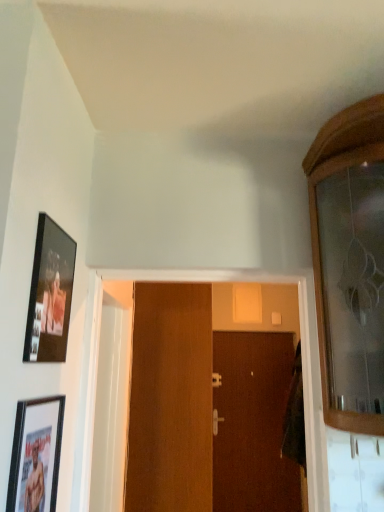
Identify the location of wooden door at center, arranged as the second door when viewed from the right. This screenshot has height=512, width=384. (170, 399).

This screenshot has height=512, width=384. Describe the element at coordinates (253, 423) in the screenshot. I see `brown wooden door at center, positioned as the 1th door in back-to-front order` at that location.

How much space does silver metallic door handle at center, the second door handle positioned from the front, occupy vertically?

It is 7.50 inches.

Where is `wooden door at center, the second door positioned from the back`? wooden door at center, the second door positioned from the back is located at coordinates (170, 399).

Which door handle is the 1st one when counting from the back of the wooden door at center, the first door when ordered from left to right? Please provide its 2D coordinates.

[(216, 421)]

Is wooden door at center, the second door positioned from the back, smaller than silver metallic door handle at center, which is counted as the 1th door handle, starting from the bottom?

No.

Is wooden door at center, arranged as the second door when viewed from the right, facing towards silver metallic door handle at center, which is counted as the 1th door handle, starting from the bottom?

No, wooden door at center, arranged as the second door when viewed from the right, is not turned towards silver metallic door handle at center, which is counted as the 1th door handle, starting from the bottom.

Between wooden door at center, the second door positioned from the back, and silver metallic door handle at center, marked as the 2th door handle in a back-to-front arrangement, which one appears on the left side from the viewer's perspective?

wooden door at center, the second door positioned from the back, is more to the left.

Is brown wooden door at center, which is the 2th door from front to back, far from silver metallic door handle at center, the first door handle from the back?

No, brown wooden door at center, which is the 2th door from front to back, is in close proximity to silver metallic door handle at center, the first door handle from the back.

Is brown wooden door at center, which is the 2th door from front to back, bigger or smaller than silver metallic door handle at center, the first door handle from the back?

brown wooden door at center, which is the 2th door from front to back, is bigger than silver metallic door handle at center, the first door handle from the back.

Is brown wooden door at center, which is the 2th door from front to back, completely or partially outside of silver metallic door handle at center, the second door handle positioned from the front?

brown wooden door at center, which is the 2th door from front to back, is positioned outside silver metallic door handle at center, the second door handle positioned from the front.

From a real-world perspective, is brown wooden door at center, arranged as the 2th door when viewed from the left, below silver metallic door handle at center, the second door handle positioned from the front?

Yes, from a real-world perspective, brown wooden door at center, arranged as the 2th door when viewed from the left, is under silver metallic door handle at center, the second door handle positioned from the front.

Is silver metallic door handle at center, arranged as the 1th door handle when viewed from the front, bigger or smaller than brown wooden door at center, which is the 2th door from front to back?

Considering their sizes, silver metallic door handle at center, arranged as the 1th door handle when viewed from the front, takes up less space than brown wooden door at center, which is the 2th door from front to back.

Which of these two, silver metallic door handle at center, which is the second door handle in top-to-bottom order, or brown wooden door at center, which is the 2th door from front to back, is thinner?

brown wooden door at center, which is the 2th door from front to back.

Consider the image. Considering the sizes of objects silver metallic door handle at center, which is counted as the 1th door handle, starting from the bottom, and brown wooden door at center, arranged as the 2th door when viewed from the left, in the image provided, who is shorter, silver metallic door handle at center, which is counted as the 1th door handle, starting from the bottom, or brown wooden door at center, arranged as the 2th door when viewed from the left,?

silver metallic door handle at center, which is counted as the 1th door handle, starting from the bottom, is shorter.

Which is less distant, (216, 425) or (270, 346)?

Point (216, 425) is closer to the camera than point (270, 346).

Which object is thinner, brown wooden door at center, arranged as the 2th door when viewed from the left, or matte black picture frame at upper left, which is the 1th picture frame in top-to-bottom order?

matte black picture frame at upper left, which is the 1th picture frame in top-to-bottom order, is thinner.

From the image's perspective, does brown wooden door at center, positioned as the 1th door in back-to-front order, appear lower than matte black picture frame at upper left, placed as the 2th picture frame when sorted from bottom to top?

Yes, from the image's perspective, brown wooden door at center, positioned as the 1th door in back-to-front order, is below matte black picture frame at upper left, placed as the 2th picture frame when sorted from bottom to top.

From a real-world perspective, which object rests below the other?

brown wooden door at center, which is counted as the 1th door, starting from the right, from a real-world perspective.

Does brown wooden door at center, which is the 2th door from front to back, appear on the left side of matte black picture frame at upper left, which is the 1th picture frame in top-to-bottom order?

Incorrect, brown wooden door at center, which is the 2th door from front to back, is not on the left side of matte black picture frame at upper left, which is the 1th picture frame in top-to-bottom order.

Does point (222, 418) come in front of point (17, 412)?

That is False.

Is silver metallic door handle at center, arranged as the 1th door handle when viewed from the front, to the right of matte black picture frame at lower left, acting as the second picture frame starting from the top, from the viewer's perspective?

Yes.

From the picture: Is silver metallic door handle at center, which is counted as the 1th door handle, starting from the bottom, beside matte black picture frame at lower left, which appears as the 1th picture frame when ordered from the bottom?

No, silver metallic door handle at center, which is counted as the 1th door handle, starting from the bottom, is not touching matte black picture frame at lower left, which appears as the 1th picture frame when ordered from the bottom.

Is silver metallic door handle at center, which is the second door handle in top-to-bottom order, inside or outside of matte black picture frame at lower left, which appears as the 1th picture frame when ordered from the bottom?

silver metallic door handle at center, which is the second door handle in top-to-bottom order, is spatially situated outside matte black picture frame at lower left, which appears as the 1th picture frame when ordered from the bottom.

Which is closer, [48,501] or [46,234]?

The point [48,501] is closer to the camera.

Considering the sizes of matte black picture frame at lower left, acting as the second picture frame starting from the top, and matte black picture frame at upper left, which is the 1th picture frame in top-to-bottom order, in the image, is matte black picture frame at lower left, acting as the second picture frame starting from the top, wider or thinner than matte black picture frame at upper left, which is the 1th picture frame in top-to-bottom order,?

In the image, matte black picture frame at lower left, acting as the second picture frame starting from the top, appears to be more narrow than matte black picture frame at upper left, which is the 1th picture frame in top-to-bottom order.

Considering the relative sizes of matte black picture frame at lower left, acting as the second picture frame starting from the top, and matte black picture frame at upper left, which is the 1th picture frame in top-to-bottom order, in the image provided, is matte black picture frame at lower left, acting as the second picture frame starting from the top, smaller than matte black picture frame at upper left, which is the 1th picture frame in top-to-bottom order,?

Yes.

Does silver metallic door handle at center, arranged as the 1th door handle when viewed from the front, have a greater height compared to wooden door at center, the first door in the front-to-back sequence?

Incorrect, the height of silver metallic door handle at center, arranged as the 1th door handle when viewed from the front, is not larger of that of wooden door at center, the first door in the front-to-back sequence.

Could you tell me if silver metallic door handle at center, marked as the 2th door handle in a back-to-front arrangement, is turned towards wooden door at center, the first door in the front-to-back sequence?

Yes.

Does silver metallic door handle at center, arranged as the 1th door handle when viewed from the front, appear on the left side of wooden door at center, the first door in the front-to-back sequence?

No, silver metallic door handle at center, arranged as the 1th door handle when viewed from the front, is not to the left of wooden door at center, the first door in the front-to-back sequence.

Is the depth of silver metallic door handle at center, arranged as the 1th door handle when viewed from the front, greater than that of wooden door at center, arranged as the second door when viewed from the right?

Yes, it is behind wooden door at center, arranged as the second door when viewed from the right.

Where is `the 2nd door above the silver metallic door handle at center, arranged as the 1th door handle when viewed from the front (from a real-world perspective)`? The height and width of the screenshot is (512, 384). the 2nd door above the silver metallic door handle at center, arranged as the 1th door handle when viewed from the front (from a real-world perspective) is located at coordinates (170, 399).

Where is `door below the silver metallic door handle at center, the second door handle positioned from the front (from the image's perspective)`? The image size is (384, 512). door below the silver metallic door handle at center, the second door handle positioned from the front (from the image's perspective) is located at coordinates (253, 423).

In the scene shown: Based on their spatial positions, is matte black picture frame at upper left, which is the 1th picture frame in top-to-bottom order, or silver metallic door handle at center, the first door handle from the back, closer to brown wooden door at center, positioned as the 1th door in back-to-front order?

silver metallic door handle at center, the first door handle from the back.

Which object lies further to the anchor point silver metallic door handle at center, the second door handle from the bottom, matte black picture frame at lower left, which appears as the 1th picture frame when ordered from the bottom, or brown wooden door at center, positioned as the 1th door in back-to-front order?

Based on the image, matte black picture frame at lower left, which appears as the 1th picture frame when ordered from the bottom, appears to be further to silver metallic door handle at center, the second door handle from the bottom.

When comparing their distances from wooden door at center, arranged as the second door when viewed from the right, does matte black picture frame at upper left, which is the 1th picture frame in top-to-bottom order, or matte black picture frame at lower left, acting as the second picture frame starting from the top, seem closer?

matte black picture frame at lower left, acting as the second picture frame starting from the top, lies closer to wooden door at center, arranged as the second door when viewed from the right, than the other object.

Estimate the real-world distances between objects in this image. Which object is further from matte black picture frame at upper left, placed as the 2th picture frame when sorted from bottom to top, wooden door at center, arranged as the second door when viewed from the right, or matte black picture frame at lower left, which appears as the 1th picture frame when ordered from the bottom?

wooden door at center, arranged as the second door when viewed from the right, lies further to matte black picture frame at upper left, placed as the 2th picture frame when sorted from bottom to top, than the other object.

Looking at the image, which one is located further to wooden door at center, arranged as the second door when viewed from the right, silver metallic door handle at center, which is the second door handle in top-to-bottom order, or brown wooden door at center, positioned as the 1th door in back-to-front order?

Based on the image, brown wooden door at center, positioned as the 1th door in back-to-front order, appears to be further to wooden door at center, arranged as the second door when viewed from the right.

Considering their positions, is wooden door at center, the first door in the front-to-back sequence, positioned further to brown wooden door at center, arranged as the 2th door when viewed from the left, than matte black picture frame at upper left, placed as the 2th picture frame when sorted from bottom to top?

matte black picture frame at upper left, placed as the 2th picture frame when sorted from bottom to top, is positioned further to the anchor brown wooden door at center, arranged as the 2th door when viewed from the left.

Considering their positions, is matte black picture frame at lower left, which appears as the 1th picture frame when ordered from the bottom, positioned further to silver metallic door handle at center, arranged as the 1th door handle when viewed from the front, than matte black picture frame at upper left, which is the 1th picture frame in top-to-bottom order?

matte black picture frame at upper left, which is the 1th picture frame in top-to-bottom order.

Considering their positions, is wooden door at center, the first door in the front-to-back sequence, positioned further to matte black picture frame at upper left, placed as the 2th picture frame when sorted from bottom to top, than brown wooden door at center, arranged as the 2th door when viewed from the left?

brown wooden door at center, arranged as the 2th door when viewed from the left, is positioned further to the anchor matte black picture frame at upper left, placed as the 2th picture frame when sorted from bottom to top.

Find the location of a particular element. This screenshot has width=384, height=512. picture frame between matte black picture frame at lower left, which appears as the 1th picture frame when ordered from the bottom, and silver metallic door handle at center, which is the first door handle in top-to-bottom order, along the z-axis is located at coordinates (50, 294).

This screenshot has height=512, width=384. Find the location of `picture frame positioned between matte black picture frame at lower left, acting as the second picture frame starting from the top, and silver metallic door handle at center, which is counted as the 1th door handle, starting from the bottom, from near to far`. picture frame positioned between matte black picture frame at lower left, acting as the second picture frame starting from the top, and silver metallic door handle at center, which is counted as the 1th door handle, starting from the bottom, from near to far is located at coordinates (50, 294).

Where is `picture frame between matte black picture frame at lower left, which appears as the 1th picture frame when ordered from the bottom, and brown wooden door at center, positioned as the 1th door in back-to-front order, in the front-back direction`? picture frame between matte black picture frame at lower left, which appears as the 1th picture frame when ordered from the bottom, and brown wooden door at center, positioned as the 1th door in back-to-front order, in the front-back direction is located at coordinates (50, 294).

The height and width of the screenshot is (512, 384). Identify the location of door handle located between wooden door at center, the first door when ordered from left to right, and silver metallic door handle at center, the second door handle from the bottom, in the depth direction. (216, 421).